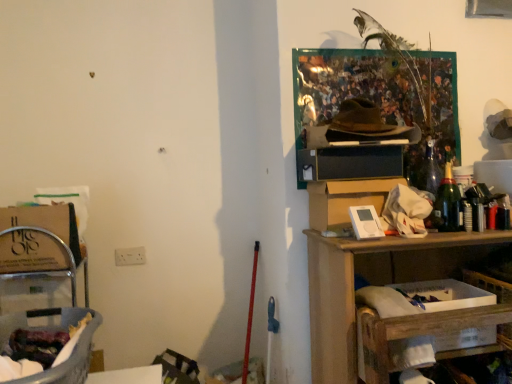
Locate an element on the screen. vacant area on top of white cardboard box at lower right (from a real-world perspective) is located at coordinates (492, 271).